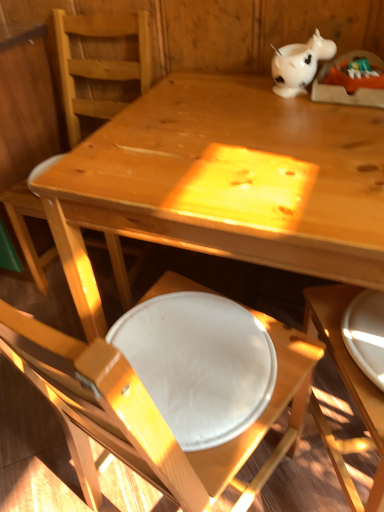
Find the location of `free spot to the left of white glossy piggy bank at upper right`. free spot to the left of white glossy piggy bank at upper right is located at coordinates (230, 94).